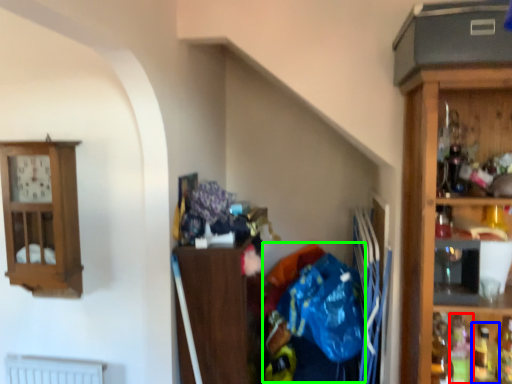
Question: Considering the real-world distances, which object is closest to bottle (highlighted by a red box)? bottle (highlighted by a blue box) or waste (highlighted by a green box).

Choices:
 (A) bottle
 (B) waste

Answer: (A)